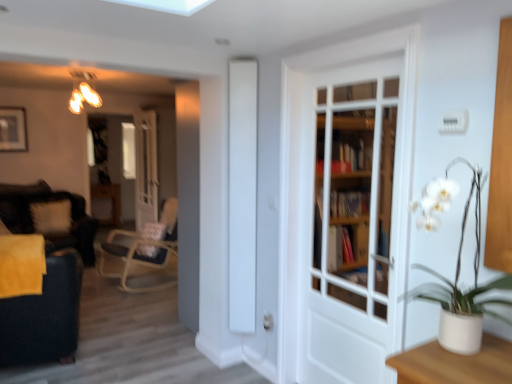
Question: Would you say white fluffy pillow at left contains white wooden door at center, placed as the second door when sorted from back to front?

Choices:
 (A) yes
 (B) no

Answer: (B)

Question: Is white fluffy pillow at left further to the viewer compared to white wooden door at center, the second door when ordered from left to right?

Choices:
 (A) no
 (B) yes

Answer: (B)

Question: Can we say white fluffy pillow at left lies outside white wooden door at center, placed as the 1th door when sorted from front to back?

Choices:
 (A) yes
 (B) no

Answer: (A)

Question: Can you confirm if white fluffy pillow at left is positioned to the right of white wooden door at center, the second door when ordered from left to right?

Choices:
 (A) no
 (B) yes

Answer: (A)

Question: Is white fluffy pillow at left beside white wooden door at center, placed as the 1th door when sorted from front to back?

Choices:
 (A) no
 (B) yes

Answer: (A)

Question: Relative to matte black picture frame at upper left, is white fluffy pillow at left in front or behind?

Choices:
 (A) behind
 (B) front

Answer: (B)

Question: Based on their sizes in the image, would you say white fluffy pillow at left is bigger or smaller than matte black picture frame at upper left?

Choices:
 (A) small
 (B) big

Answer: (B)

Question: From a real-world perspective, relative to matte black picture frame at upper left, is white fluffy pillow at left vertically above or below?

Choices:
 (A) above
 (B) below

Answer: (B)

Question: In terms of width, does white fluffy pillow at left look wider or thinner when compared to matte black picture frame at upper left?

Choices:
 (A) thin
 (B) wide

Answer: (B)

Question: From the image's perspective, is white glossy door at center, positioned as the first door in left-to-right order, located above or below white wooden door at center, placed as the second door when sorted from back to front?

Choices:
 (A) above
 (B) below

Answer: (A)

Question: From a real-world perspective, is white glossy door at center, positioned as the 1th door in back-to-front order, above or below white wooden door at center, placed as the 1th door when sorted from front to back?

Choices:
 (A) below
 (B) above

Answer: (A)

Question: Is white glossy door at center, the second door in the front-to-back sequence, to the left or to the right of white wooden door at center, which is the 1th door from right to left, in the image?

Choices:
 (A) left
 (B) right

Answer: (A)

Question: Is white glossy door at center, placed as the 2th door when sorted from right to left, taller or shorter than white wooden door at center, placed as the second door when sorted from back to front?

Choices:
 (A) short
 (B) tall

Answer: (B)

Question: From a real-world perspective, is white glossy door at center, placed as the 2th door when sorted from right to left, positioned above or below white fluffy pillow at left?

Choices:
 (A) below
 (B) above

Answer: (B)

Question: Is white glossy door at center, positioned as the 1th door in back-to-front order, spatially inside white fluffy pillow at left, or outside of it?

Choices:
 (A) inside
 (B) outside

Answer: (B)